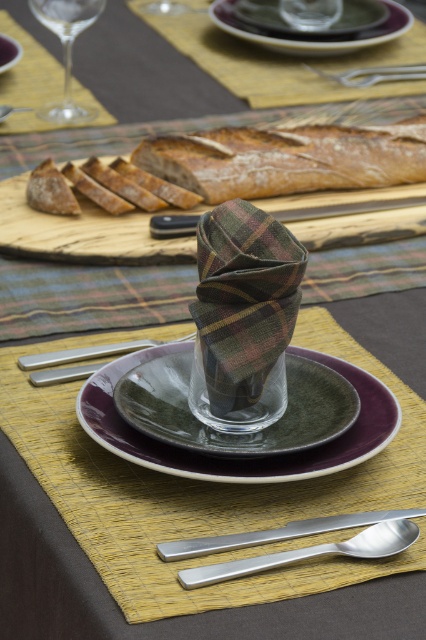
Question: Does green matte plate at center have a larger size compared to purple glossy plate at center?

Choices:
 (A) yes
 (B) no

Answer: (A)

Question: Among these objects, which one is farthest from the camera?

Choices:
 (A) green matte plate at upper center
 (B) silver metallic fork at center
 (C) transparent glass wine glass at upper left

Answer: (A)

Question: Does plaid fabric napkin at center appear over green matte plate at upper center?

Choices:
 (A) no
 (B) yes

Answer: (A)

Question: Among these objects, which one is nearest to the camera?

Choices:
 (A) purple glossy plate at center
 (B) silver metallic fork at upper center
 (C) green matte plate at upper center
 (D) silver metallic fork at center

Answer: (D)

Question: Which point is closer to the camera taking this photo?

Choices:
 (A) (276, 177)
 (B) (244, 436)
 (C) (348, 35)
 (D) (111, 346)

Answer: (B)

Question: Where is brown crusty bread at center located in relation to green matte plate at upper center in the image?

Choices:
 (A) right
 (B) left

Answer: (B)